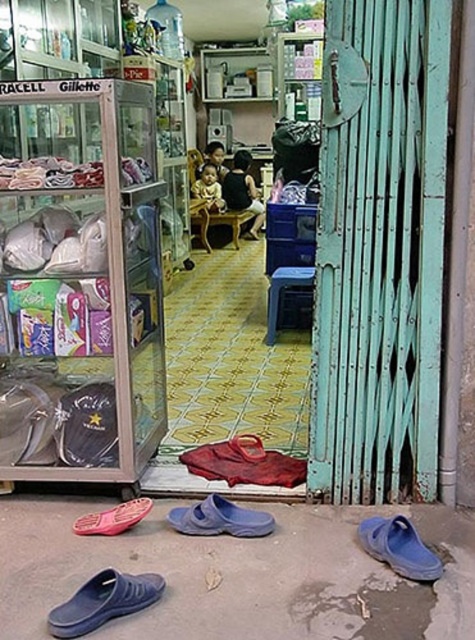
Does point (38, 164) come behind point (219, 502)?

That is True.

Can you confirm if transparent plastic display case at left is taller than blue rubber slipper at lower center?

Yes.

Does point (123, 456) come farther from viewer compared to point (199, 513)?

Yes, it is.

Where is `transparent plastic display case at left`? The height and width of the screenshot is (640, 475). transparent plastic display case at left is located at coordinates (79, 282).

Can you confirm if transparent plastic display case at left is taller than blue rubber slipper at lower left?

Yes.

Is transparent plastic display case at left wider than blue rubber slipper at lower left?

Correct, the width of transparent plastic display case at left exceeds that of blue rubber slipper at lower left.

Where is `transparent plastic display case at left`? The width and height of the screenshot is (475, 640). transparent plastic display case at left is located at coordinates pyautogui.click(x=79, y=282).

Locate an element on the screen. transparent plastic display case at left is located at coordinates (79, 282).

Is teal painted metal gate at right to the right of blue rubber clog at lower right from the viewer's perspective?

Incorrect, teal painted metal gate at right is not on the right side of blue rubber clog at lower right.

Is teal painted metal gate at right closer to camera compared to blue rubber clog at lower right?

No.

You are a GUI agent. You are given a task and a screenshot of the screen. Output one action in this format:
    pyautogui.click(x=<x>, y=<y>)
    Task: Click on the teal painted metal gate at right
    
    Given the screenshot: What is the action you would take?
    pyautogui.click(x=380, y=252)